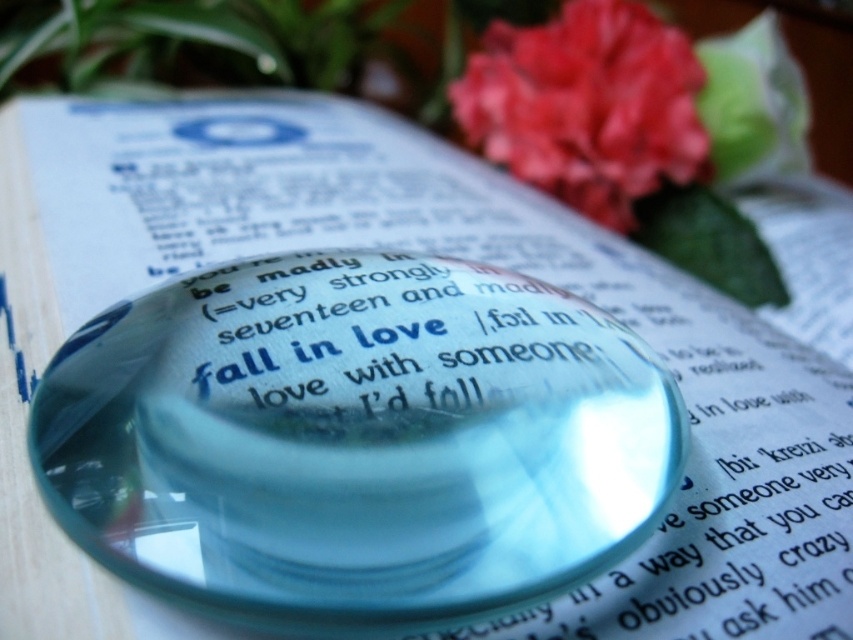
Question: Does transparent glass magnifying glass at center lie in front of vivid red petals at upper right?

Choices:
 (A) yes
 (B) no

Answer: (A)

Question: Which point appears farthest from the camera in this image?

Choices:
 (A) (596, 116)
 (B) (126, 422)

Answer: (A)

Question: Among these objects, which one is nearest to the camera?

Choices:
 (A) vivid red petals at upper right
 (B) transparent glass magnifying glass at center

Answer: (B)

Question: In this image, where is transparent glass magnifying glass at center located relative to vivid red petals at upper right?

Choices:
 (A) above
 (B) below

Answer: (B)

Question: Is the position of transparent glass magnifying glass at center less distant than that of vivid red petals at upper right?

Choices:
 (A) no
 (B) yes

Answer: (B)